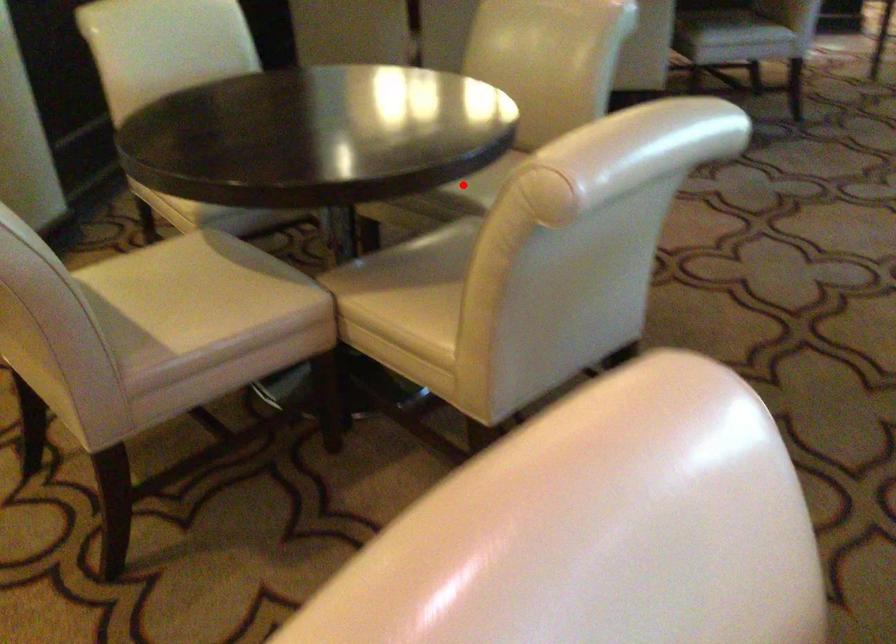
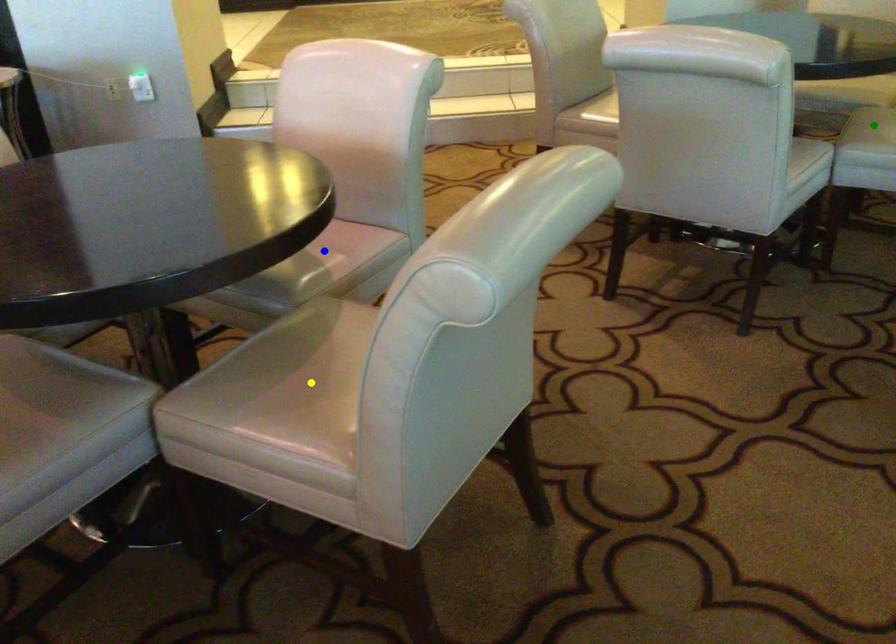
Question: I am providing you with two images of the same scene from different viewpoints. A red point is marked on the first image. You are given multiple points on the second image. Can you choose the point in image 2 that corresponds to the point in image 1?

Choices:
 (A) yellow point
 (B) blue point
 (C) green point

Answer: (C)